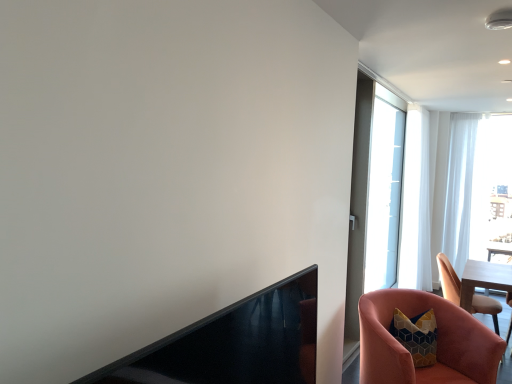
The height and width of the screenshot is (384, 512). Identify the location of pink velvet chair at lower right, which appears as the 1th chair when viewed from the left. (437, 342).

The width and height of the screenshot is (512, 384). In order to click on black glossy fireplace at lower left in this screenshot , I will do click(x=234, y=343).

The width and height of the screenshot is (512, 384). What do you see at coordinates (415, 205) in the screenshot?
I see `white sheer curtain at right, positioned as the 1th curtain in left-to-right order` at bounding box center [415, 205].

This screenshot has width=512, height=384. Identify the location of white sheer curtain at right, positioned as the 1th curtain in left-to-right order. (415, 205).

At what (x,y) coordinates should I click in order to perform the action: click on white sheer curtain at right, placed as the second curtain when sorted from left to right. Please return your answer as a coordinate pair (x, y). This screenshot has width=512, height=384. Looking at the image, I should click on (459, 188).

Locate an element on the screen. The height and width of the screenshot is (384, 512). pink velvet chair at lower right, the 2th chair from the right is located at coordinates (437, 342).

Looking at this image, is black glossy fireplace at lower left wider or thinner than transparent glass screen door at upper right?

Clearly, black glossy fireplace at lower left has more width compared to transparent glass screen door at upper right.

Considering the positions of objects black glossy fireplace at lower left and transparent glass screen door at upper right in the image provided, who is behind, black glossy fireplace at lower left or transparent glass screen door at upper right?

transparent glass screen door at upper right is further away from the camera.

In terms of size, does black glossy fireplace at lower left appear bigger or smaller than transparent glass screen door at upper right?

Clearly, black glossy fireplace at lower left is smaller in size than transparent glass screen door at upper right.

Would you say black glossy fireplace at lower left contains transparent glass screen door at upper right?

No.

Is black glossy fireplace at lower left wider or thinner than pink velvet chair at lower right, which appears as the 1th chair when viewed from the left?

In the image, black glossy fireplace at lower left appears to be more narrow than pink velvet chair at lower right, which appears as the 1th chair when viewed from the left.

Is black glossy fireplace at lower left turned away from pink velvet chair at lower right, the 2th chair from the right?

No, black glossy fireplace at lower left is not facing the opposite direction of pink velvet chair at lower right, the 2th chair from the right.

Is black glossy fireplace at lower left next to pink velvet chair at lower right, which ranks as the 2th chair in back-to-front order?

They are not placed beside each other.

From a real-world perspective, between black glossy fireplace at lower left and pink velvet chair at lower right, which appears as the 1th chair when viewed from the left, who is vertically lower?

From a 3D spatial view, pink velvet chair at lower right, which appears as the 1th chair when viewed from the left, is below.

Is white sheer curtain at right, placed as the second curtain when sorted from left to right, outside of black glossy fireplace at lower left?

Yes, white sheer curtain at right, placed as the second curtain when sorted from left to right, is outside of black glossy fireplace at lower left.

Is white sheer curtain at right, which is the 1th curtain from right to left, in front of or behind black glossy fireplace at lower left in the image?

In the image, white sheer curtain at right, which is the 1th curtain from right to left, appears behind black glossy fireplace at lower left.

Looking at the image, does white sheer curtain at right, placed as the second curtain when sorted from left to right, seem bigger or smaller compared to black glossy fireplace at lower left?

Considering their sizes, white sheer curtain at right, placed as the second curtain when sorted from left to right, takes up more space than black glossy fireplace at lower left.

Looking at this image, who is smaller, white sheer curtain at right, which is the 1th curtain from right to left, or white sheer curtain at right, the 2th curtain viewed from the right?

white sheer curtain at right, which is the 1th curtain from right to left.

How different are the orientations of white sheer curtain at right, which is the 1th curtain from right to left, and white sheer curtain at right, the 2th curtain viewed from the right, in degrees?

84.7 degrees separate the facing orientations of white sheer curtain at right, which is the 1th curtain from right to left, and white sheer curtain at right, the 2th curtain viewed from the right.

Is white sheer curtain at right, placed as the second curtain when sorted from left to right, facing towards white sheer curtain at right, positioned as the 1th curtain in left-to-right order?

No, white sheer curtain at right, placed as the second curtain when sorted from left to right, is not oriented towards white sheer curtain at right, positioned as the 1th curtain in left-to-right order.

Between white sheer curtain at right, which is the 1th curtain from right to left, and white sheer curtain at right, the 2th curtain viewed from the right, which one has more height?

white sheer curtain at right, the 2th curtain viewed from the right.

Is white sheer curtain at right, positioned as the 1th curtain in left-to-right order, oriented away from pink velvet chair at lower right, which appears as the 1th chair when viewed from the left?

No, white sheer curtain at right, positioned as the 1th curtain in left-to-right order, is not facing the opposite direction of pink velvet chair at lower right, which appears as the 1th chair when viewed from the left.

Does white sheer curtain at right, the 2th curtain viewed from the right, have a greater width compared to pink velvet chair at lower right, which ranks as the 2th chair in back-to-front order?

No.

Where is `the 2nd chair counting from the left of the white sheer curtain at right, positioned as the 1th curtain in left-to-right order`? the 2nd chair counting from the left of the white sheer curtain at right, positioned as the 1th curtain in left-to-right order is located at coordinates (437, 342).

Does white sheer curtain at right, the 2th curtain viewed from the right, have a larger size compared to pink velvet chair at lower right, the 2th chair from the right?

Yes, white sheer curtain at right, the 2th curtain viewed from the right, is bigger than pink velvet chair at lower right, the 2th chair from the right.

Based on their positions, is pink velvet chair at lower right, which ranks as the 2th chair in back-to-front order, located to the left or right of pink velvet chair at lower right, which is the 2th chair in left-to-right order?

pink velvet chair at lower right, which ranks as the 2th chair in back-to-front order, is to the left of pink velvet chair at lower right, which is the 2th chair in left-to-right order.

Which of these two, pink velvet chair at lower right, which ranks as the 2th chair in back-to-front order, or pink velvet chair at lower right, which ranks as the 1th chair in right-to-left order, stands shorter?

Standing shorter between the two is pink velvet chair at lower right, which ranks as the 2th chair in back-to-front order.

From the image's perspective, is pink velvet chair at lower right, the 1th chair viewed from the front, above or below pink velvet chair at lower right, which is the 2th chair in left-to-right order?

From the image's perspective, pink velvet chair at lower right, the 1th chair viewed from the front, appears below pink velvet chair at lower right, which is the 2th chair in left-to-right order.

Which of these two, pink velvet chair at lower right, the 2th chair from the right, or pink velvet chair at lower right, the 1th chair from the back, is wider?

pink velvet chair at lower right, the 2th chair from the right.

From the picture: Considering the relative sizes of transparent glass screen door at upper right and white sheer curtain at right, the 2th curtain viewed from the right, in the image provided, is transparent glass screen door at upper right smaller than white sheer curtain at right, the 2th curtain viewed from the right,?

Incorrect, transparent glass screen door at upper right is not smaller in size than white sheer curtain at right, the 2th curtain viewed from the right.

Based on the photo, how different are the orientations of transparent glass screen door at upper right and white sheer curtain at right, positioned as the 1th curtain in left-to-right order, in degrees?

transparent glass screen door at upper right and white sheer curtain at right, positioned as the 1th curtain in left-to-right order, are facing 5.79 degrees away from each other.

From the picture: Could you tell me if transparent glass screen door at upper right is facing white sheer curtain at right, the 2th curtain viewed from the right?

Yes, transparent glass screen door at upper right is turned towards white sheer curtain at right, the 2th curtain viewed from the right.

Considering the relative sizes of transparent glass screen door at upper right and white sheer curtain at right, the 2th curtain viewed from the right, in the image provided, is transparent glass screen door at upper right thinner than white sheer curtain at right, the 2th curtain viewed from the right,?

Indeed, transparent glass screen door at upper right has a lesser width compared to white sheer curtain at right, the 2th curtain viewed from the right.

In the image, there is a transparent glass screen door at upper right. Where is `fireplace below it (from a real-world perspective)`? This screenshot has width=512, height=384. fireplace below it (from a real-world perspective) is located at coordinates (234, 343).

Find the location of a particular element. Image resolution: width=512 pixels, height=384 pixels. fireplace above the pink velvet chair at lower right, the 2th chair from the right (from a real-world perspective) is located at coordinates (234, 343).

Based on their spatial positions, is transparent glass screen door at upper right or white sheer curtain at right, which is the 1th curtain from right to left, closer to white sheer curtain at right, positioned as the 1th curtain in left-to-right order?

white sheer curtain at right, which is the 1th curtain from right to left, lies closer to white sheer curtain at right, positioned as the 1th curtain in left-to-right order, than the other object.

From the image, which object appears to be nearer to black glossy fireplace at lower left, pink velvet chair at lower right, which ranks as the 2th chair in back-to-front order, or pink velvet chair at lower right, the 2th chair in the front-to-back sequence?

Based on the image, pink velvet chair at lower right, which ranks as the 2th chair in back-to-front order, appears to be nearer to black glossy fireplace at lower left.

Estimate the real-world distances between objects in this image. Which object is further from transparent glass screen door at upper right, pink velvet chair at lower right, the 2th chair in the front-to-back sequence, or white sheer curtain at right, which is the 1th curtain from right to left?

Based on the image, pink velvet chair at lower right, the 2th chair in the front-to-back sequence, appears to be further to transparent glass screen door at upper right.

Looking at the image, which one is located further to white sheer curtain at right, positioned as the 1th curtain in left-to-right order, black glossy fireplace at lower left or pink velvet chair at lower right, which ranks as the 1th chair in right-to-left order?

Based on the image, black glossy fireplace at lower left appears to be further to white sheer curtain at right, positioned as the 1th curtain in left-to-right order.

Estimate the real-world distances between objects in this image. Which object is further from pink velvet chair at lower right, which ranks as the 1th chair in right-to-left order, black glossy fireplace at lower left or transparent glass screen door at upper right?

black glossy fireplace at lower left lies further to pink velvet chair at lower right, which ranks as the 1th chair in right-to-left order, than the other object.

In the scene shown: Estimate the real-world distances between objects in this image. Which object is closer to white sheer curtain at right, positioned as the 1th curtain in left-to-right order, pink velvet chair at lower right, the 1th chair from the back, or white sheer curtain at right, placed as the second curtain when sorted from left to right?

white sheer curtain at right, placed as the second curtain when sorted from left to right, is closer to white sheer curtain at right, positioned as the 1th curtain in left-to-right order.

Looking at the image, which one is located further to pink velvet chair at lower right, the 2th chair from the right, white sheer curtain at right, positioned as the 1th curtain in left-to-right order, or transparent glass screen door at upper right?

white sheer curtain at right, positioned as the 1th curtain in left-to-right order.

Based on their spatial positions, is black glossy fireplace at lower left or white sheer curtain at right, the 2th curtain viewed from the right, closer to transparent glass screen door at upper right?

white sheer curtain at right, the 2th curtain viewed from the right, is positioned closer to the anchor transparent glass screen door at upper right.

Where is `screen door between pink velvet chair at lower right, which appears as the 1th chair when viewed from the left, and white sheer curtain at right, which is the 1th curtain from right to left, from front to back`? The width and height of the screenshot is (512, 384). screen door between pink velvet chair at lower right, which appears as the 1th chair when viewed from the left, and white sheer curtain at right, which is the 1th curtain from right to left, from front to back is located at coordinates (373, 197).

Locate an element on the screen. screen door positioned between pink velvet chair at lower right, which is the 2th chair in left-to-right order, and white sheer curtain at right, placed as the second curtain when sorted from left to right, from near to far is located at coordinates (373, 197).

You are a GUI agent. You are given a task and a screenshot of the screen. Output one action in this format:
    pyautogui.click(x=<x>, y=<y>)
    Task: Click on the chair positioned between pink velvet chair at lower right, which appears as the 1th chair when viewed from the left, and transparent glass screen door at upper right from near to far
    
    Given the screenshot: What is the action you would take?
    pyautogui.click(x=448, y=279)

Image resolution: width=512 pixels, height=384 pixels. What are the coordinates of `screen door between pink velvet chair at lower right, the 2th chair in the front-to-back sequence, and white sheer curtain at right, positioned as the 1th curtain in left-to-right order, in the front-back direction` in the screenshot? It's located at (373, 197).